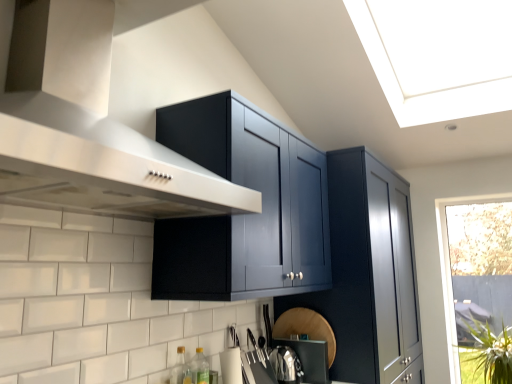
Question: Is stainless steel vent at upper left in front of green leafy plant at lower right?

Choices:
 (A) no
 (B) yes

Answer: (B)

Question: Considering the relative sizes of stainless steel vent at upper left and green leafy plant at lower right in the image provided, is stainless steel vent at upper left smaller than green leafy plant at lower right?

Choices:
 (A) yes
 (B) no

Answer: (B)

Question: Is stainless steel vent at upper left positioned with its back to green leafy plant at lower right?

Choices:
 (A) yes
 (B) no

Answer: (B)

Question: From the image's perspective, is stainless steel vent at upper left located beneath green leafy plant at lower right?

Choices:
 (A) no
 (B) yes

Answer: (A)

Question: Is stainless steel vent at upper left further to the viewer compared to green leafy plant at lower right?

Choices:
 (A) yes
 (B) no

Answer: (B)

Question: Is stainless steel vent at upper left thinner than green leafy plant at lower right?

Choices:
 (A) no
 (B) yes

Answer: (A)

Question: Is green glass bottle at lower center, which is the 1th bottle from back to front, bigger than glossy dark blue cabinet at upper center?

Choices:
 (A) yes
 (B) no

Answer: (B)

Question: Is green glass bottle at lower center, the second bottle positioned from the front, oriented away from glossy dark blue cabinet at upper center?

Choices:
 (A) yes
 (B) no

Answer: (B)

Question: Does green glass bottle at lower center, which is the 1th bottle from back to front, come in front of glossy dark blue cabinet at upper center?

Choices:
 (A) yes
 (B) no

Answer: (A)

Question: From a real-world perspective, is green glass bottle at lower center, the second bottle positioned from the front, positioned over glossy dark blue cabinet at upper center based on gravity?

Choices:
 (A) yes
 (B) no

Answer: (B)

Question: Is green glass bottle at lower center, the second bottle positioned from the front, wider than glossy dark blue cabinet at upper center?

Choices:
 (A) no
 (B) yes

Answer: (A)

Question: Is green glass bottle at lower center, the second bottle positioned from the front, positioned behind stainless steel vent at upper left?

Choices:
 (A) yes
 (B) no

Answer: (A)